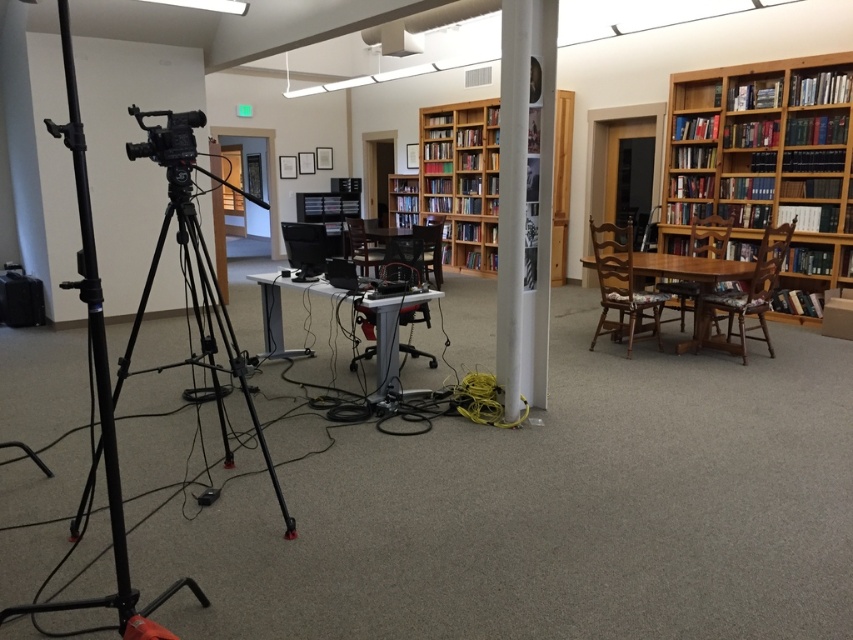
You are a camera operator who needs to move the black matte tripod at left closer to the wooden bookshelf at center by 2 meters. Is this possible without exceeding the room dimensions?

The wooden bookshelf at center is currently 4.61 meters away from the black matte tripod at left. If you move the black matte tripod at left closer by 2 meters, the new distance would be 2.61 meters. Since the room is large enough to accommodate this adjustment, it is possible to move the black matte tripod at left closer to the wooden bookshelf at center by 2 meters.

You are an actor entering the room and need to locate the matte black video camera at left and the wooden bookcase at right. According to the scene, which object is closer to you when you first enter the room?

The wooden bookcase at right is closer to you when you first enter the room because the matte black video camera at left is behind it.

You are setting up a new desk in the library and need to place it between the wooden bookshelf at center and the black matte tripod at left. Based on their widths, which side of the desk should be closer to the narrower object to ensure stability?

The wooden bookshelf at center is narrower than the black matte tripod at left, so the desk should be placed closer to the wooden bookshelf at center to ensure stability.